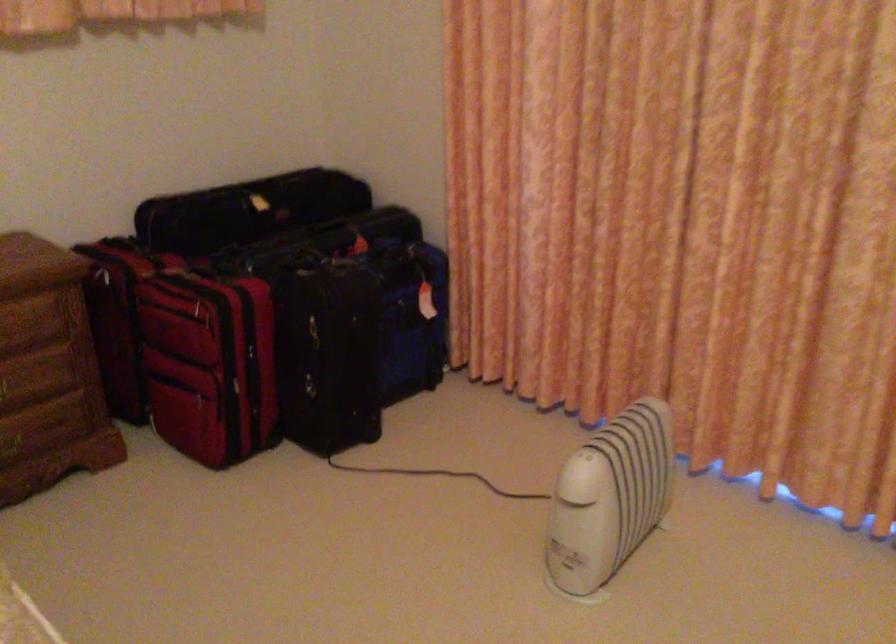
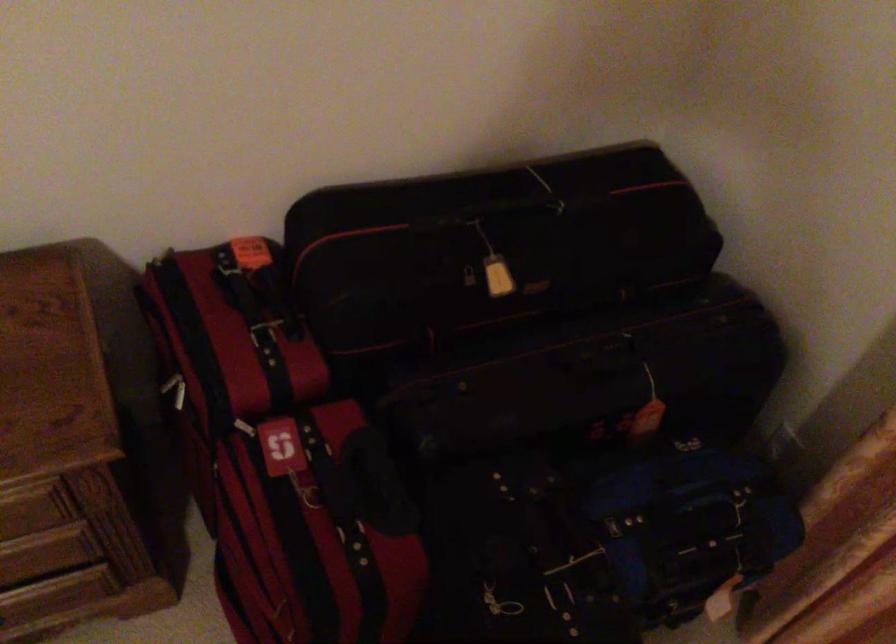
Where in the second image is the point corresponding to the point at 145,249 from the first image?

(264, 334)